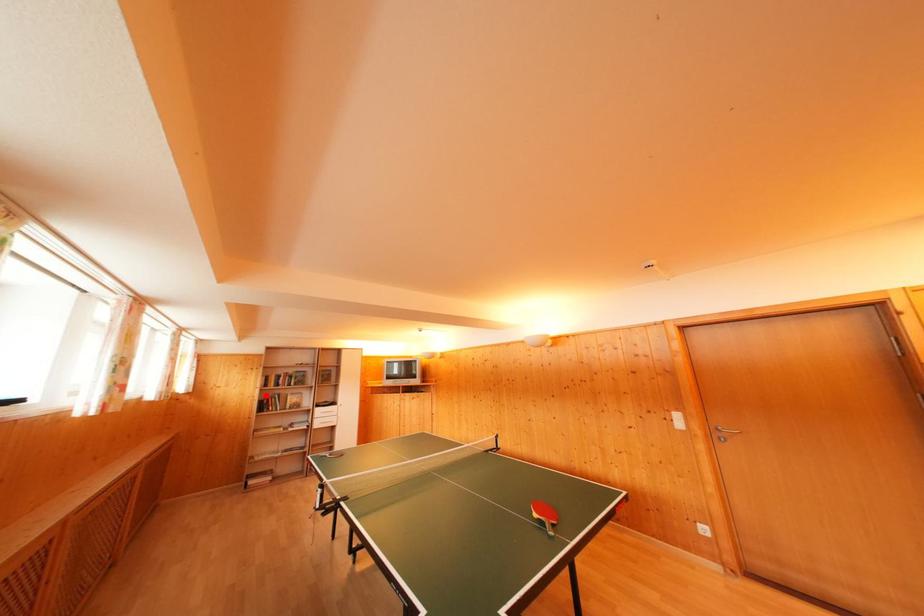
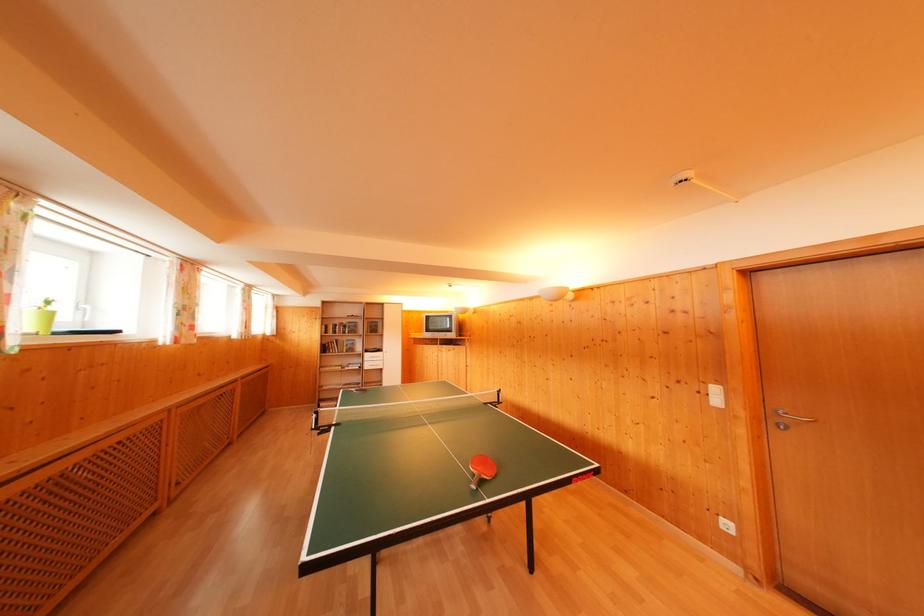
The point at the highlighted location is marked in the first image. Where is the corresponding point in the second image?

(326, 342)